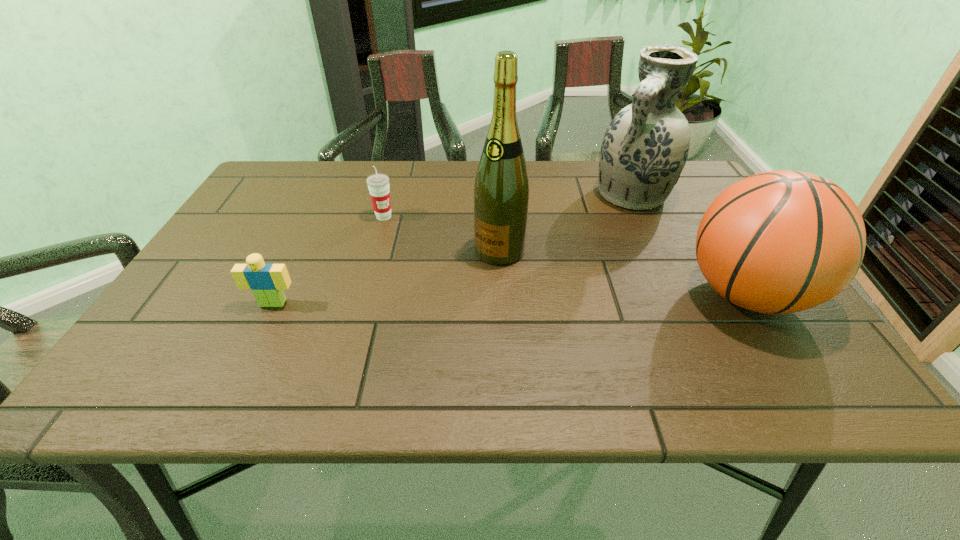
This screenshot has height=540, width=960. What are the coordinates of `vacant space on the desktop that is between the leftmost object and the basketball and is positioned on the side of the second shortest object with the logo` in the screenshot? It's located at (471, 300).

This screenshot has height=540, width=960. What are the coordinates of `free space on the desktop that is between the Lego and the third shortest object and is positioned on the front-facing side of the third object from right to left` in the screenshot? It's located at (452, 300).

Image resolution: width=960 pixels, height=540 pixels. I want to click on vacant space on the desktop that is between the Lego and the basketball and is positioned with the handle on the side of the fourth shortest object, so click(559, 298).